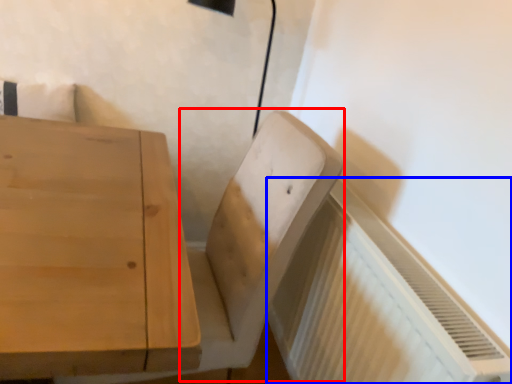
Question: Which point is further to the camera, swivel chair (highlighted by a red box) or radiator (highlighted by a blue box)?

Choices:
 (A) swivel chair
 (B) radiator

Answer: (A)